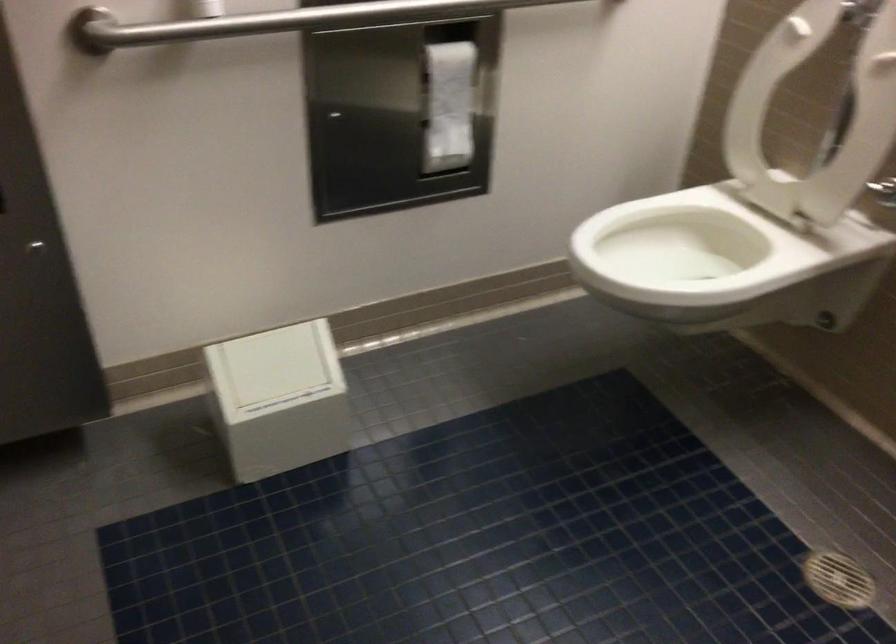
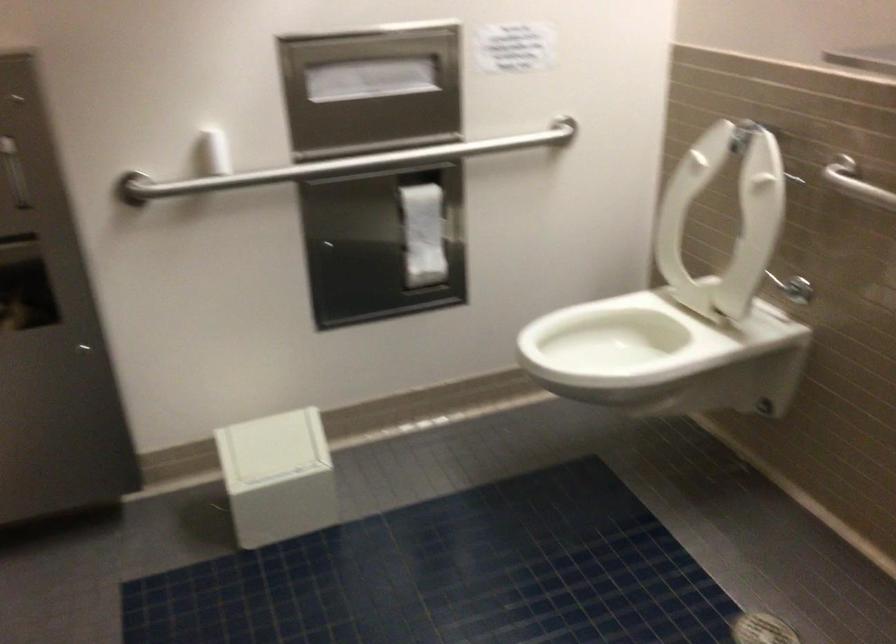
The point at (668,238) is marked in the first image. Where is the corresponding point in the second image?

(616, 336)